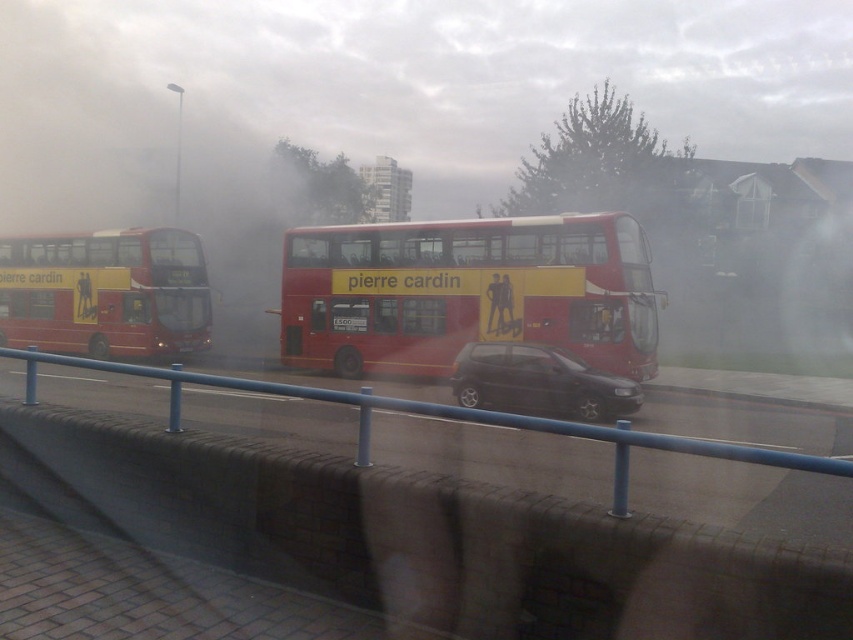
You are a pedestrian standing on the bridge and want to cross the road to the other side. You see the matte red bus at left and the shiny black hatchback at center. Which vehicle is higher from the ground?

The matte red bus at left is above the shiny black hatchback at center, so it is higher from the ground.

You are a delivery driver carrying a package that must be placed on the blue metal rail at center. Your vehicle is a shiny black hatchback at center. Can you safely reach the rail without getting out of the car?

The blue metal rail at center is 2.88 meters away from the shiny black hatchback at center. Since the rail is more than 2 meters away, you can safely reach it without leaving the car.